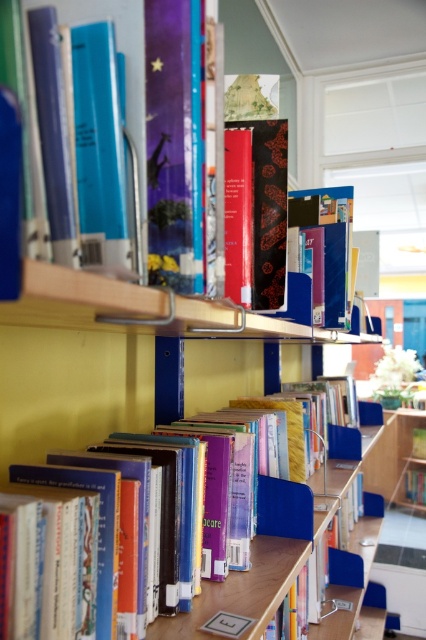
In the scene shown: You are a librarian trying to locate a specific book. You remember that the book is a hardcover and is placed at the center of the shelf. Based on the coordinates provided, can you determine the exact position of the hardcover book at center on the shelf?

The hardcover book at center is located at point coordinates 0.800 in the x axis and 0.439 in the y axis.

You are a librarian who needs to place a new book on the shelf. The book is 35 inches thick. Can you fit it on the shelf where the matte black book at center is located?

The matte black book at center is 35.36 inches away from the camera, so the shelf is not thick enough to hold a book of that size. Please find a thicker shelf.